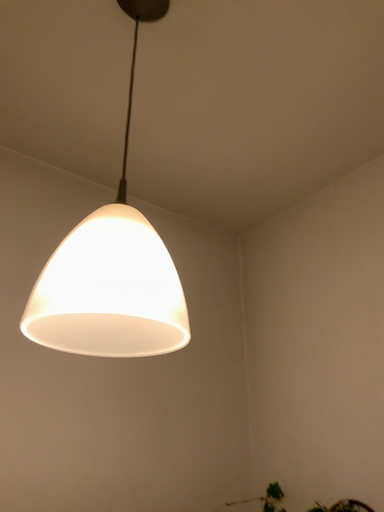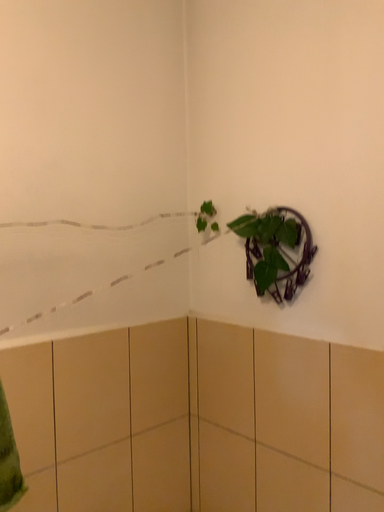
Question: Which way did the camera rotate in the video?

Choices:
 (A) rotated right
 (B) rotated left

Answer: (A)